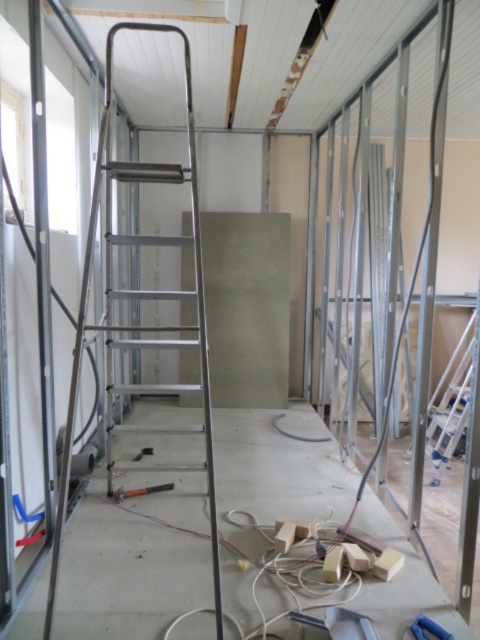
Question: Which object appears closest to the camera in this image?

Choices:
 (A) silver metallic ladder at left
 (B) black rubber hammer at center

Answer: (A)

Question: In this image, where is silver metallic ladder at left located relative to black rubber hammer at center?

Choices:
 (A) below
 (B) above

Answer: (B)

Question: Is silver metallic ladder at left thinner than black rubber hammer at center?

Choices:
 (A) no
 (B) yes

Answer: (A)

Question: Which point is farther from the camera taking this photo?

Choices:
 (A) (143, 490)
 (B) (73, 406)

Answer: (A)

Question: Can you confirm if silver metallic ladder at left is bigger than black rubber hammer at center?

Choices:
 (A) yes
 (B) no

Answer: (A)